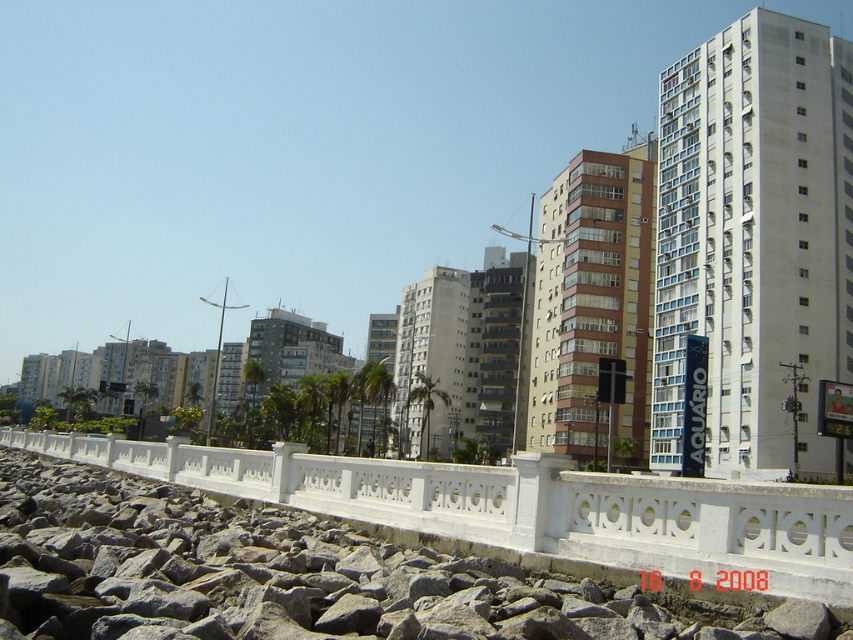
Who is positioned more to the left, white concrete building at right or brown concrete building at center?

Positioned to the left is brown concrete building at center.

You are a GUI agent. You are given a task and a screenshot of the screen. Output one action in this format:
    pyautogui.click(x=<x>, y=<y>)
    Task: Click on the white concrete building at right
    The width and height of the screenshot is (853, 640).
    Given the screenshot: What is the action you would take?
    pyautogui.click(x=753, y=237)

Does point (689, 144) come closer to viewer compared to point (512, 384)?

Yes, point (689, 144) is closer to viewer.

What are the coordinates of `white concrete building at right` in the screenshot? It's located at (753, 237).

Does white concrete building at right have a greater width compared to white concrete building at center?

Correct, the width of white concrete building at right exceeds that of white concrete building at center.

Who is lower down, white concrete building at right or white concrete building at center?

white concrete building at center

The image size is (853, 640). Describe the element at coordinates (753, 237) in the screenshot. I see `white concrete building at right` at that location.

At what (x,y) coordinates should I click in order to perform the action: click on white concrete building at right. Please return your answer as a coordinate pair (x, y). The width and height of the screenshot is (853, 640). Looking at the image, I should click on (x=753, y=237).

Does white stone fence at center have a greater width compared to brown glass building at center?

Indeed, white stone fence at center has a greater width compared to brown glass building at center.

Between white stone fence at center and brown glass building at center, which one is positioned lower?

white stone fence at center

Is point (560, 538) positioned after point (585, 269)?

No, it is not.

This screenshot has width=853, height=640. I want to click on white stone fence at center, so point(524,506).